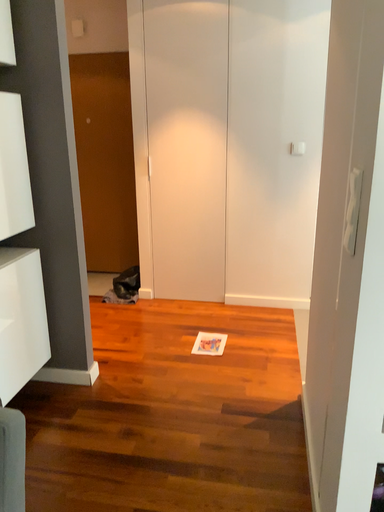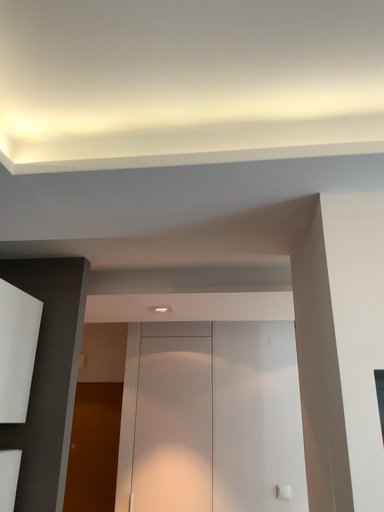
Question: How did the camera likely rotate when shooting the video?

Choices:
 (A) rotated downward
 (B) rotated upward

Answer: (B)